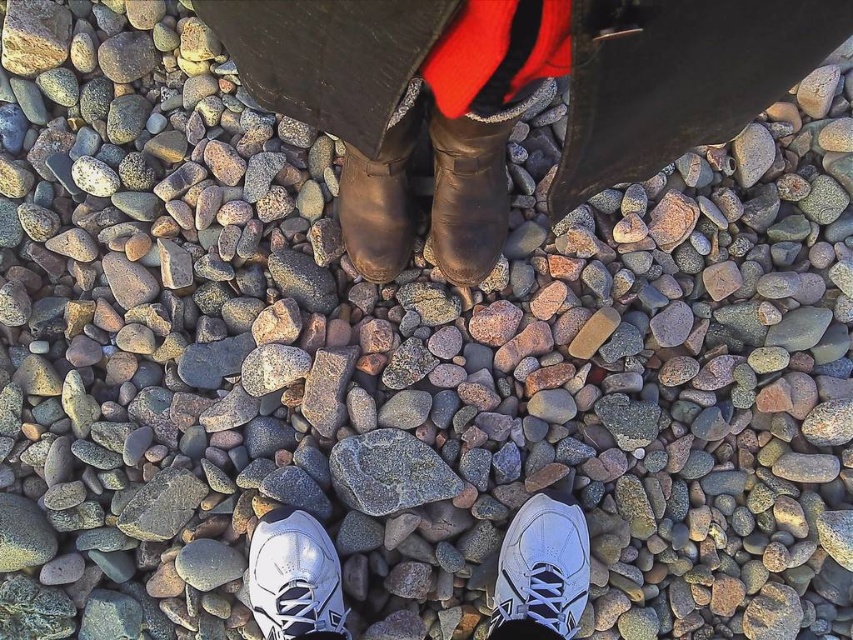
Does white mesh shoe at lower center lie behind white leather shoe at lower center?

No, white mesh shoe at lower center is in front of white leather shoe at lower center.

Between white mesh shoe at lower center and white leather shoe at lower center, which one appears on the left side from the viewer's perspective?

Positioned to the left is white leather shoe at lower center.

Between point (515, 554) and point (271, 577), which one is positioned in front?

Positioned in front is point (271, 577).

Identify the location of white mesh shoe at lower center. The height and width of the screenshot is (640, 853). (543, 566).

Between leather boots at center and white mesh shoe at lower center, which one appears on the right side from the viewer's perspective?

white mesh shoe at lower center is more to the right.

Can you confirm if leather boots at center is positioned above white mesh shoe at lower center?

Indeed, leather boots at center is positioned over white mesh shoe at lower center.

Is point (762, 45) farther from viewer compared to point (553, 554)?

No.

The width and height of the screenshot is (853, 640). In order to click on leather boots at center in this screenshot , I will do `click(509, 96)`.

Is white leather shoe at lower center below rusty metallic rock at center?

Indeed, white leather shoe at lower center is positioned under rusty metallic rock at center.

Does white leather shoe at lower center appear on the right side of rusty metallic rock at center?

Incorrect, white leather shoe at lower center is not on the right side of rusty metallic rock at center.

You are a GUI agent. You are given a task and a screenshot of the screen. Output one action in this format:
    pyautogui.click(x=<x>, y=<y>)
    Task: Click on the white leather shoe at lower center
    The height and width of the screenshot is (640, 853).
    Given the screenshot: What is the action you would take?
    pyautogui.click(x=294, y=579)